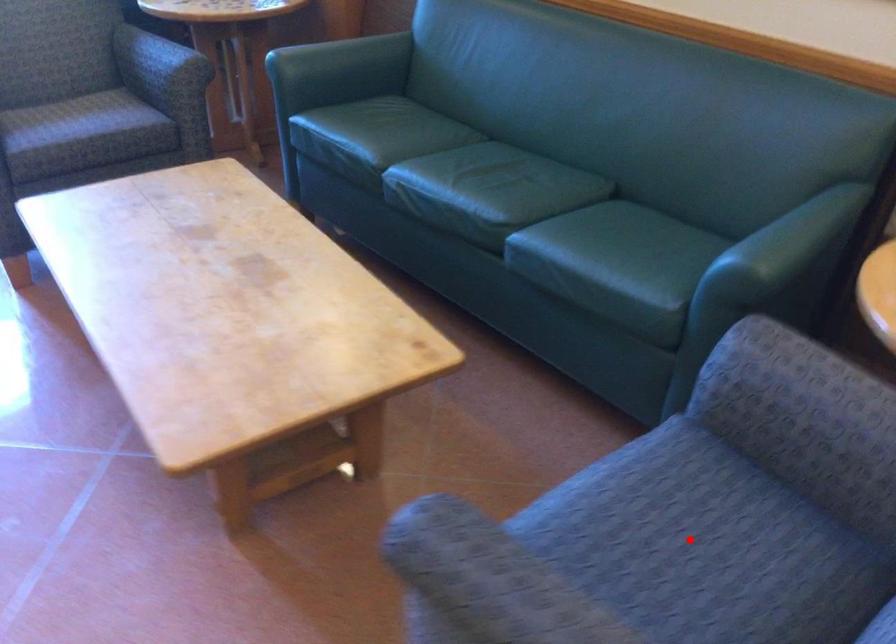
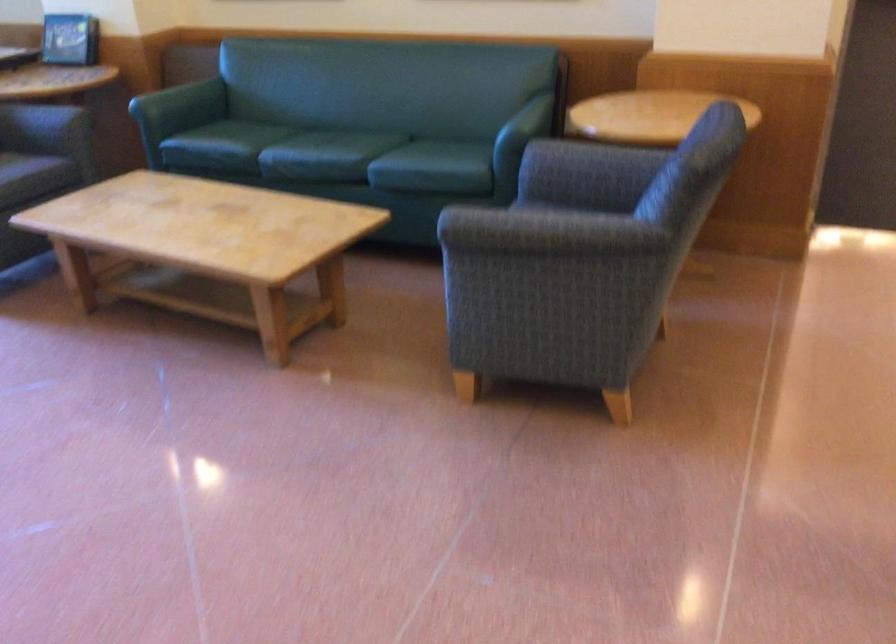
Question: I am providing you with two images of the same scene from different viewpoints. A red point is marked on the first image. Is the red point's position out of view in image 2?

Choices:
 (A) Yes
 (B) No

Answer: (A)